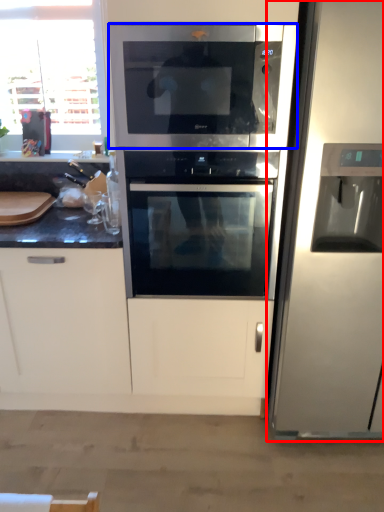
Question: Which object is closer to the camera taking this photo, refrigerator (highlighted by a red box) or microwave oven (highlighted by a blue box)?

Choices:
 (A) refrigerator
 (B) microwave oven

Answer: (A)